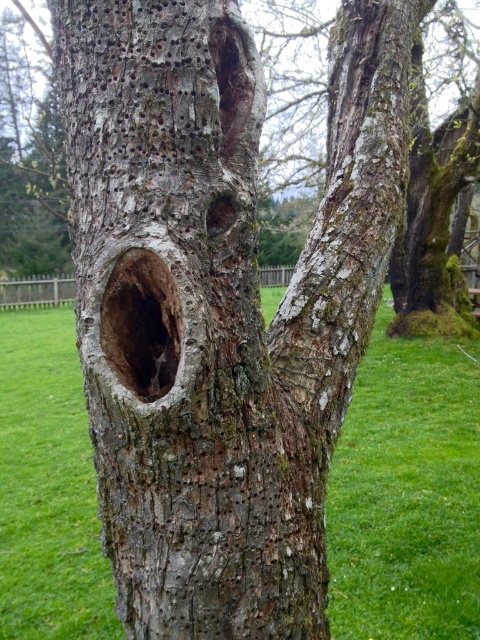
You are an environmental scientist examining the tree trunk. You notice a point at coordinates (x=432, y=225). Based on the scene, what is the significance of this point on the tree trunk?

The point at coordinates (x=432, y=225) indicates green mossy bark at upper right, which is a lighter area compared to the rest of the trunk.

You are a botanist examining the tree trunk. You notice the green mossy bark at upper right and the smooth bark hole at center. Which of these two features has a greater width?

The green mossy bark at upper right might be wider than smooth bark hole at center according to the description.

You are a gardener who wants to mow the green grass at center and smooth bark hole at center. Which one can you mow?

The green grass at center can be mowed, but the smooth bark hole at center cannot be mowed since it is a part of the tree trunk and not grass.